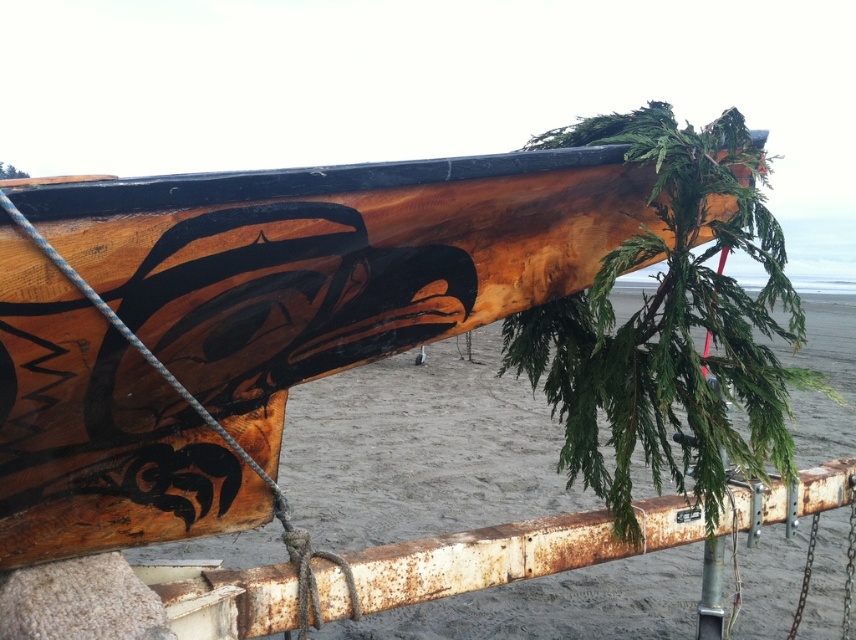
You are a photographer trying to capture the wooden canoe at center and the rusty metal rail at lower center in a single shot. Since you want the canoe to dominate the frame, which object should you focus on first and why?

The wooden canoe at center has a greater height compared to the rusty metal rail at lower center, so focusing on the wooden canoe at center first will ensure it takes up more space in the frame, making it the dominant subject.

Please use the coordinates provided to identify the object at point (342, 259) in the scene. What is the object?

The wooden canoe at center is represented by point (342, 259).